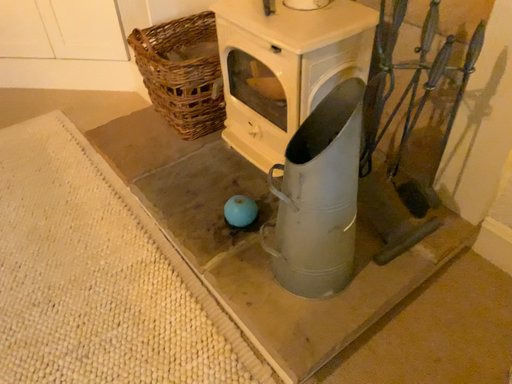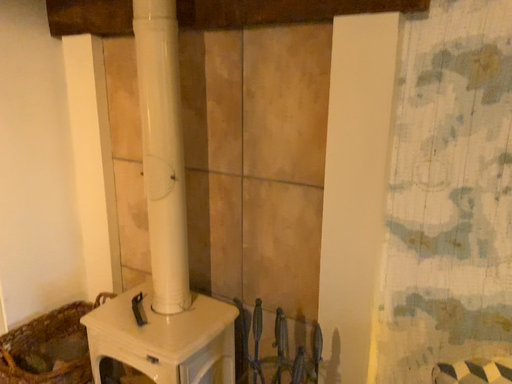
Question: Which way did the camera rotate in the video?

Choices:
 (A) rotated downward
 (B) rotated upward

Answer: (B)